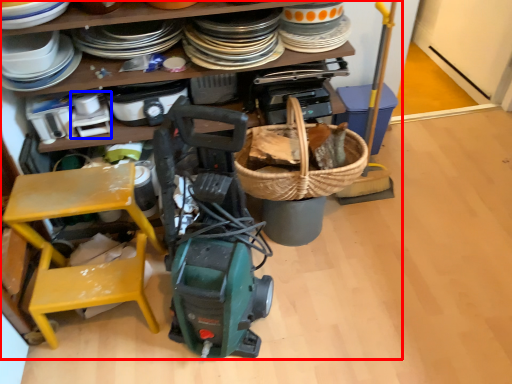
Question: Which object is closer to the camera taking this photo, collection (highlighted by a red box) or appliance (highlighted by a blue box)?

Choices:
 (A) collection
 (B) appliance

Answer: (A)